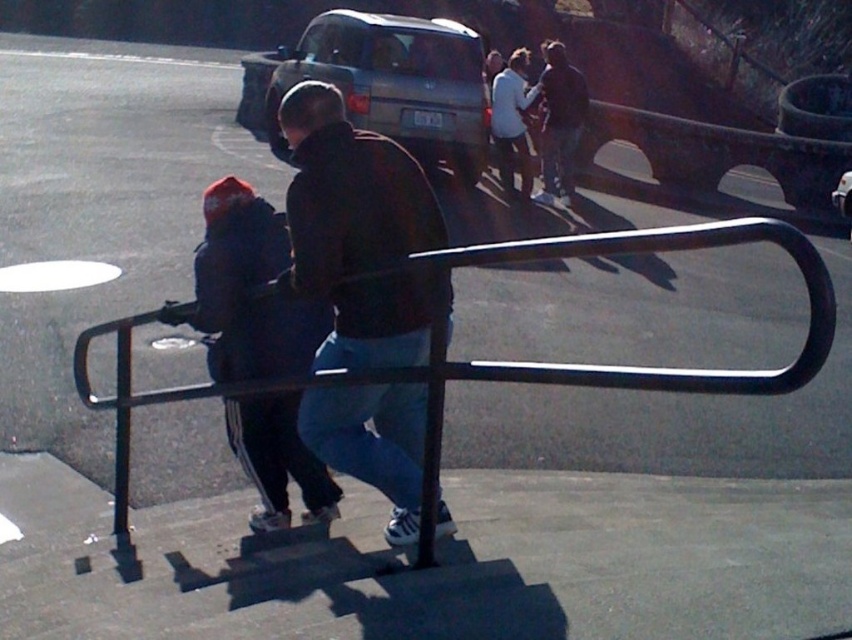
Where is `dark blue fabric jacket at left`? dark blue fabric jacket at left is located at coordinates (248, 289).

Can you confirm if dark blue fabric jacket at left is thinner than silver metallic suv at center?

Indeed, dark blue fabric jacket at left has a lesser width compared to silver metallic suv at center.

Is point (231, 433) less distant than point (394, 17)?

Yes, point (231, 433) is in front of point (394, 17).

This screenshot has height=640, width=852. In order to click on dark blue fabric jacket at left in this screenshot , I will do `click(248, 289)`.

Is silver metallic suv at center positioned before dark blue jeans at center?

Yes, silver metallic suv at center is closer to the viewer.

Between silver metallic suv at center and dark blue jeans at center, which one has more height?

Standing taller between the two is silver metallic suv at center.

Who is more distant from viewer, (x=360, y=61) or (x=577, y=92)?

The point (x=577, y=92) is behind.

You are a GUI agent. You are given a task and a screenshot of the screen. Output one action in this format:
    pyautogui.click(x=<x>, y=<y>)
    Task: Click on the silver metallic suv at center
    The image size is (852, 640).
    Given the screenshot: What is the action you would take?
    pyautogui.click(x=383, y=83)

The height and width of the screenshot is (640, 852). Find the location of `dark brown leather jacket at center`. dark brown leather jacket at center is located at coordinates (360, 234).

Is dark brown leather jacket at center closer to the viewer compared to silver metallic suv at center?

Yes, it is in front of silver metallic suv at center.

Between point (429, 282) and point (271, 136), which one is positioned behind?

Point (271, 136)

Locate an element on the screen. The width and height of the screenshot is (852, 640). dark brown leather jacket at center is located at coordinates (360, 234).